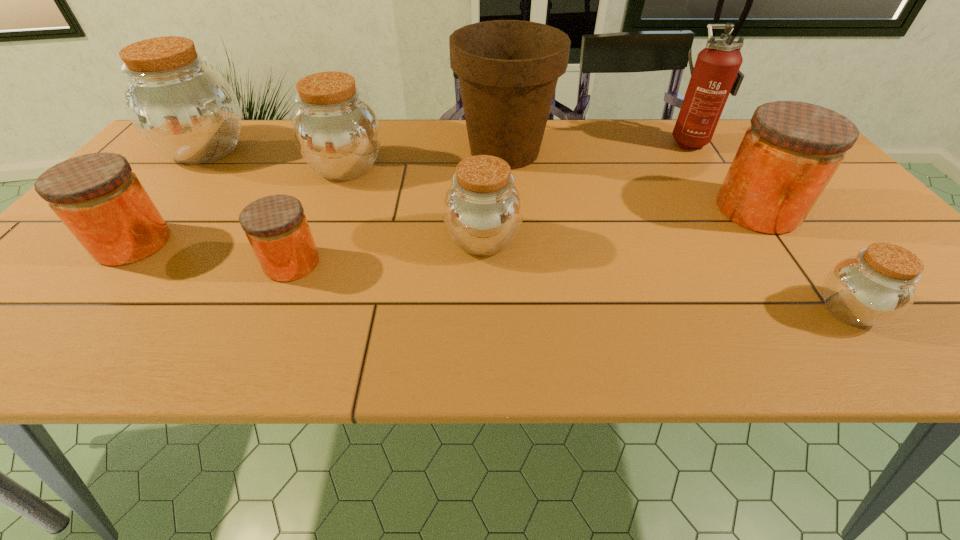
Identify which brown jar is located as the nearest to the second nearest brown jar. Please provide its 2D coordinates. Your answer should be formatted as a tuple, i.e. [(x, y)], where the tuple contains the x and y coordinates of a point satisfying the conditions above.

[(337, 133)]

Locate an element on the screen. brown jar that is the third closest to the second nearest brown jar is located at coordinates (185, 109).

Image resolution: width=960 pixels, height=540 pixels. I want to click on the third closest orange jar to the fire extinguisher, so click(100, 200).

You are a GUI agent. You are given a task and a screenshot of the screen. Output one action in this format:
    pyautogui.click(x=<x>, y=<y>)
    Task: Click on the second closest orange jar to the fifth jar from left to right
    
    Given the screenshot: What is the action you would take?
    coord(788,155)

Find the location of `vacant region that satisfies the following two spatial constraints: 1. at the nozzle of the fire extinguisher; 2. on the front side of the flowerpot`. vacant region that satisfies the following two spatial constraints: 1. at the nozzle of the fire extinguisher; 2. on the front side of the flowerpot is located at coordinates (697, 151).

Identify the location of free space that satisfies the following two spatial constraints: 1. on the back side of the rightmost orange jar; 2. at the nozzle of the fire extinguisher. The width and height of the screenshot is (960, 540). (708, 140).

Where is `vacant space that satisfies the following two spatial constraints: 1. on the back side of the second brown jar from left to right; 2. on the right side of the second orange jar from left to right`? The width and height of the screenshot is (960, 540). vacant space that satisfies the following two spatial constraints: 1. on the back side of the second brown jar from left to right; 2. on the right side of the second orange jar from left to right is located at coordinates (333, 167).